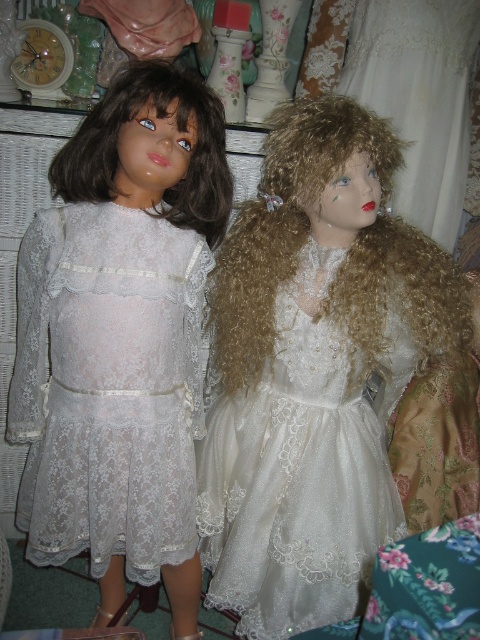
From the picture: Based on the scene description, where is the lace fabric dress at left located in the image?

The lace fabric dress at left is located at point (108, 387) in the image.

You are standing in front of a display of vintage clothing. You see the lace fabric dress at left. Can you comfortably reach into your pocket to retrieve a hand sanitizer bottle that is 15 cm in length without moving your position?

The lace fabric dress at left is 1.10 meters away from the viewer. Since the distance is more than enough to comfortably reach into your pocket, you can retrieve the hand sanitizer bottle without moving.

You are a fashion designer examining the vintage display. The point at coordinates (108, 387) is marked on the image. Which object from the scene does this point belong to?

The point at coordinates (108, 387) corresponds to the lace fabric dress at left.